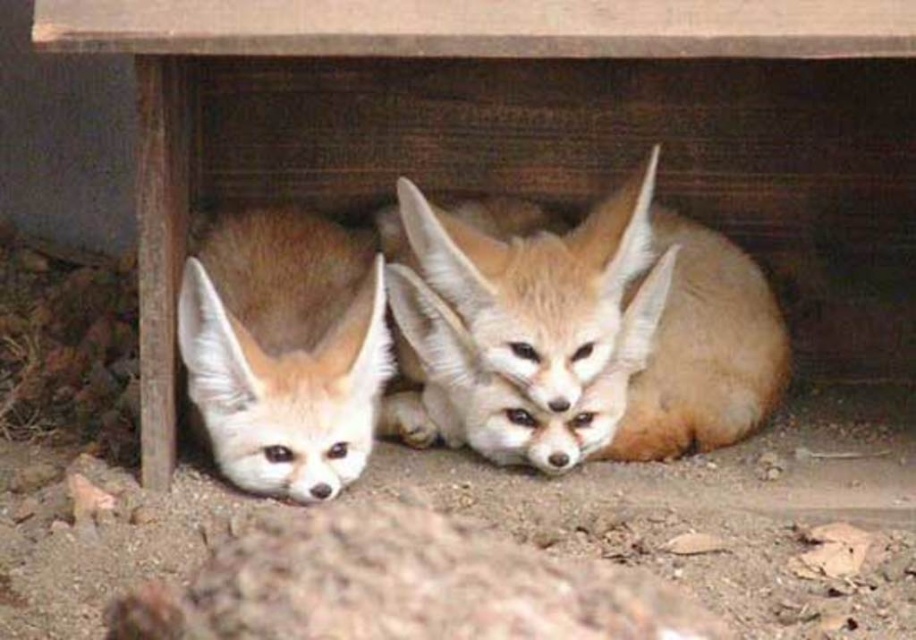
Looking at this image, you are a wildlife photographer trying to capture a closeup shot of both the light brown fur at center and the fuzzy brown fox at lower left. Given that your camera can focus on objects within a 10 inch range, will you be able to capture both subjects in focus without adjusting your camera settings?

The light brown fur at center and fuzzy brown fox at lower left are 12.82 inches apart from each other, which exceeds the camera focus range of 10 inches. Therefore, you will need to adjust your camera settings to ensure both subjects are in focus.

You are observing two foxes in the image. The light brown fur at center and the fuzzy brown fox at lower left are both visible. Which one is located to the right of the other?

The light brown fur at center is positioned on the right side of fuzzy brown fox at lower left.